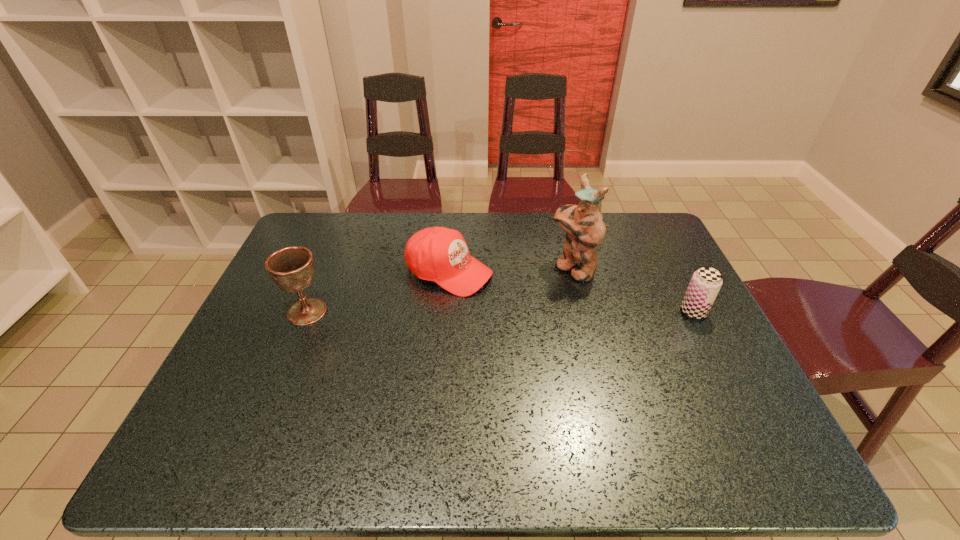
The width and height of the screenshot is (960, 540). In the image, there is a desktop. Identify the location of free space at the left edge. (276, 319).

The image size is (960, 540). Identify the location of blank space at the right edge of the desktop. (660, 269).

At what (x,y) coordinates should I click in order to perform the action: click on free spot at the far left corner of the desktop. Please return your answer as a coordinate pair (x, y). This screenshot has width=960, height=540. Looking at the image, I should click on (297, 235).

Image resolution: width=960 pixels, height=540 pixels. Find the location of `vacant area at the near left corner of the desktop`. vacant area at the near left corner of the desktop is located at coordinates (236, 406).

Find the location of `free point at the near right corner`. free point at the near right corner is located at coordinates (739, 393).

This screenshot has width=960, height=540. I want to click on empty space between the chalice and the beer can, so click(500, 312).

Identify the location of free spot between the second tallest object and the tallest object. This screenshot has height=540, width=960. (440, 290).

The width and height of the screenshot is (960, 540). In order to click on free point between the rightmost object and the leftmost object in this screenshot , I will do `click(500, 312)`.

Where is `empty location between the baseball cap and the figurine`? The width and height of the screenshot is (960, 540). empty location between the baseball cap and the figurine is located at coordinates (511, 270).

Identify the location of vacant space in between the second object from right to left and the baseball cap. The height and width of the screenshot is (540, 960). (511, 270).